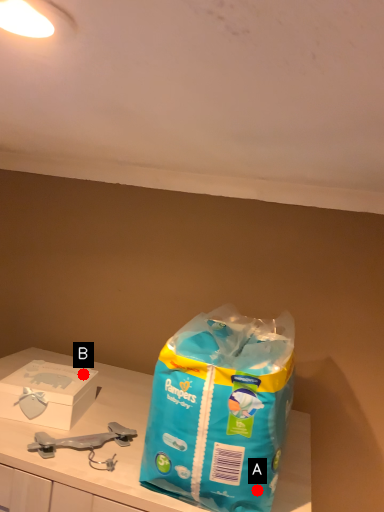
Question: Two points are circled on the image, labeled by A and B beside each circle. Which point appears farthest from the camera in this image?

Choices:
 (A) A is further
 (B) B is further

Answer: (B)